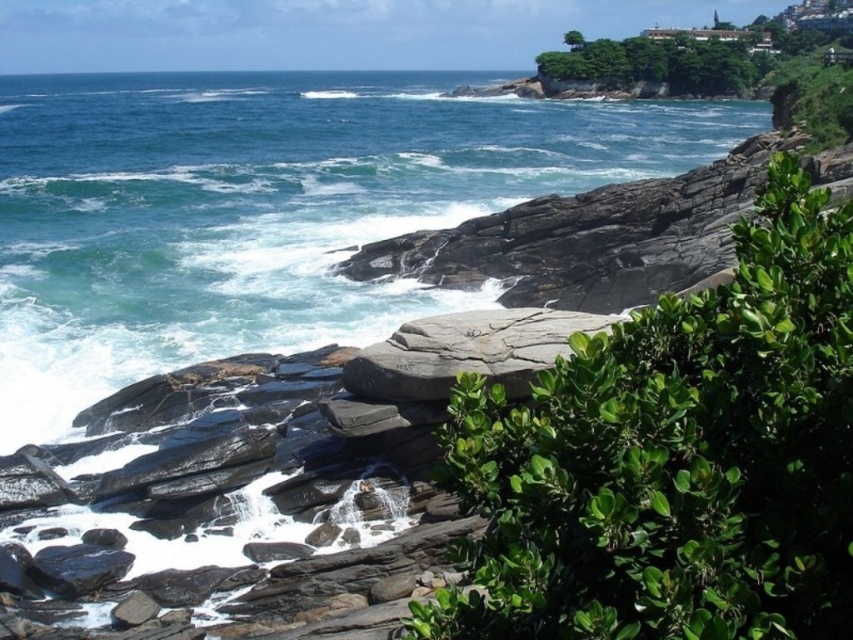
Measure the distance between blue water at upper left and camera.

They are 23.40 meters apart.

Between point (42, 312) and point (343, 371), which one is positioned behind?

Point (42, 312)

Which is behind, point (437, 157) or point (490, 323)?

The point (437, 157) is more distant.

Where is `blue water at upper left`? Image resolution: width=853 pixels, height=640 pixels. blue water at upper left is located at coordinates (267, 209).